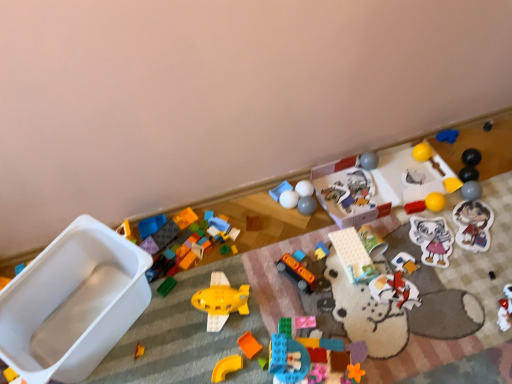
What are the coordinates of `empty space that is in between white matte figure at center, the nineteenth toy viewed from the left, and orange matte block at center, acting as the sixth toy starting from the left` in the screenshot? It's located at (337, 306).